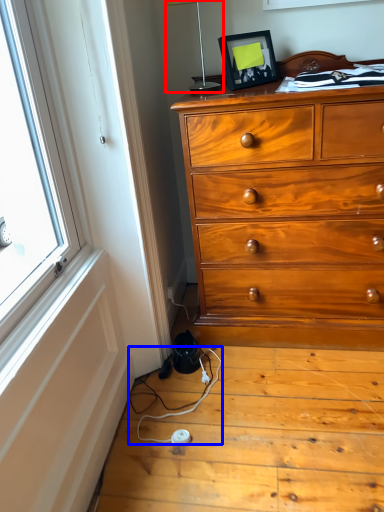
Question: Which of the following is the closest to the observer, table lamp (highlighted by a red box) or twin (highlighted by a blue box)?

Choices:
 (A) table lamp
 (B) twin

Answer: (B)